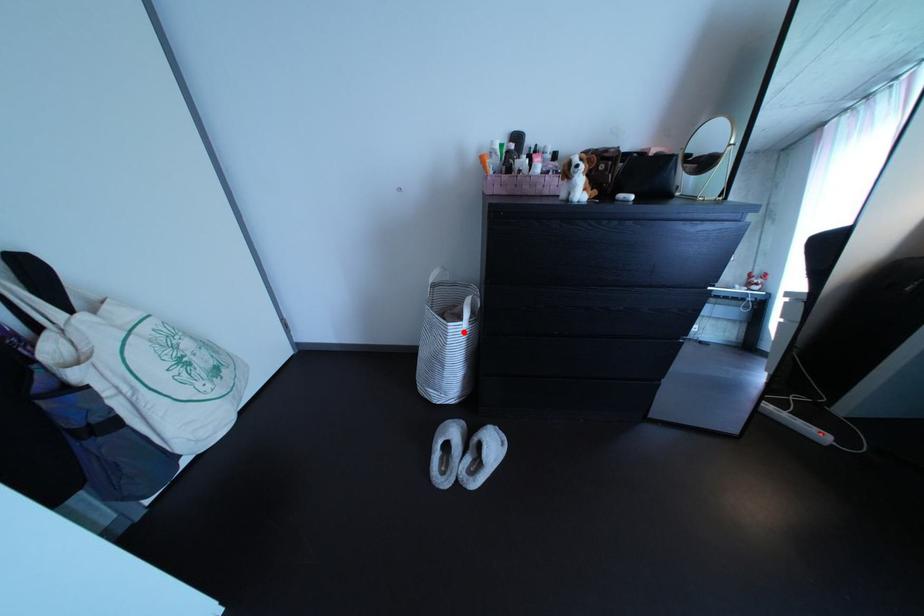
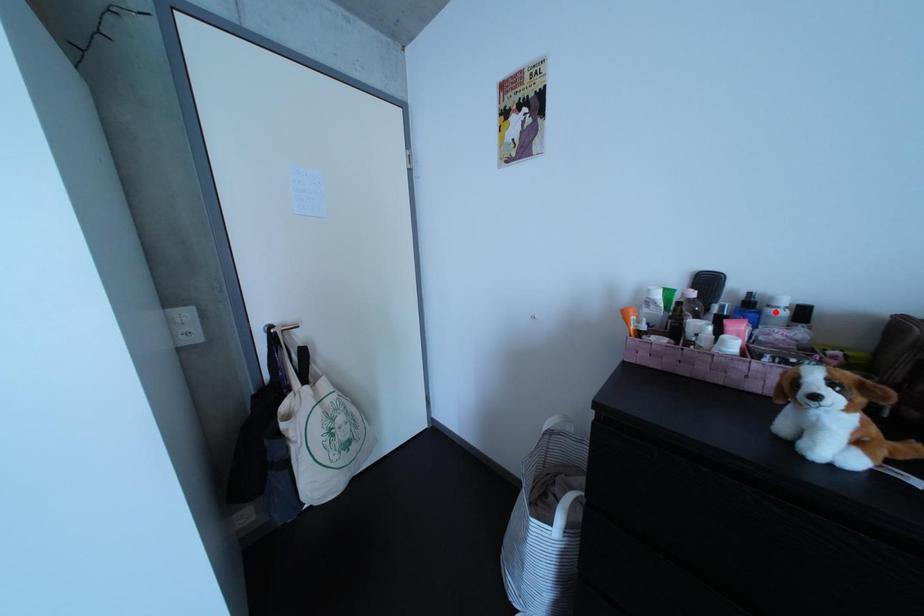
I am providing you with two images of the same scene from different viewpoints. A red point is marked on the first image and another point is marked on the second image. Is the red point in image1 aligned with the point shown in image2?

No